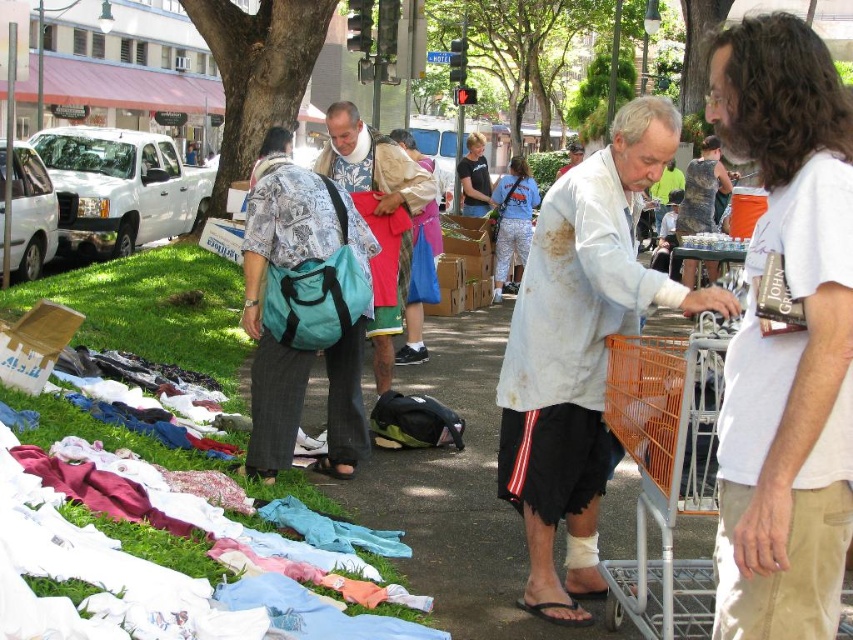
Question: Is camouflage fabric dress at center further to camera compared to matte white shirt at center?

Choices:
 (A) no
 (B) yes

Answer: (A)

Question: Which object is positioned closest to the white cotton t-shirt at center?

Choices:
 (A) white stained shirt at center
 (B) orange metal shopping cart at lower right
 (C) camouflage fabric dress at center

Answer: (B)

Question: In this image, where is orange metal shopping cart at lower right located relative to matte blue backpack at center?

Choices:
 (A) left
 (B) right

Answer: (B)

Question: Which of these objects is positioned farthest from the matte khaki shirt at center?

Choices:
 (A) matte blue backpack at center
 (B) matte white shirt at center
 (C) teal fabric bag at center
 (D) blue cotton shirt at center

Answer: (B)

Question: Which of the following is the closest to the observer?

Choices:
 (A) (775, 577)
 (B) (711, 228)
 (C) (520, 202)
 (D) (474, 156)

Answer: (A)

Question: Is blue cotton shirt at center bigger than camouflage fabric dress at center?

Choices:
 (A) no
 (B) yes

Answer: (A)